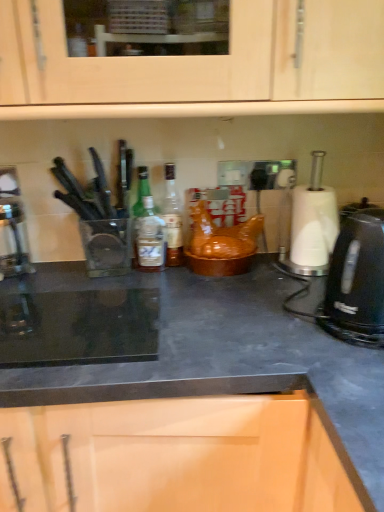
You are a GUI agent. You are given a task and a screenshot of the screen. Output one action in this format:
    pyautogui.click(x=<x>, y=<y>)
    Task: Click on the free space in front of translucent glass bottle at center
    
    Given the screenshot: What is the action you would take?
    pyautogui.click(x=173, y=281)